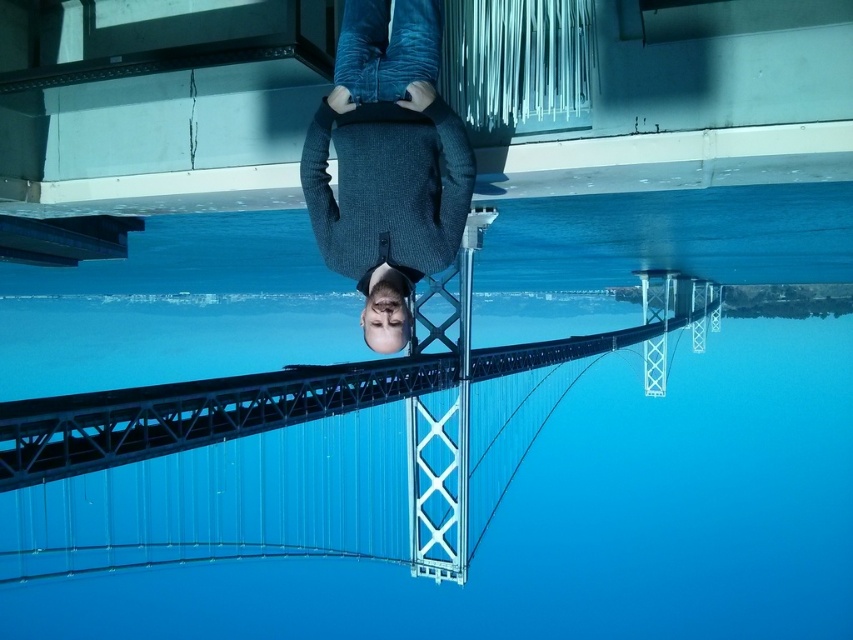
Question: Which of the following is the farthest from the observer?

Choices:
 (A) dark blue sweater at center
 (B) blue glass swimming pool at center
 (C) metallic bridge rail at center

Answer: (B)

Question: Which of the following is the closest to the observer?

Choices:
 (A) metallic bridge rail at center
 (B) dark blue sweater at center

Answer: (B)

Question: Does dark blue sweater at center lie behind metallic bridge rail at center?

Choices:
 (A) no
 (B) yes

Answer: (A)

Question: Which point is farther from the camera taking this photo?

Choices:
 (A) (387, 132)
 (B) (178, 426)
 (C) (84, 276)

Answer: (C)

Question: Is dark blue sweater at center below metallic bridge rail at center?

Choices:
 (A) yes
 (B) no

Answer: (B)

Question: Is blue glass swimming pool at center above metallic bridge rail at center?

Choices:
 (A) yes
 (B) no

Answer: (B)